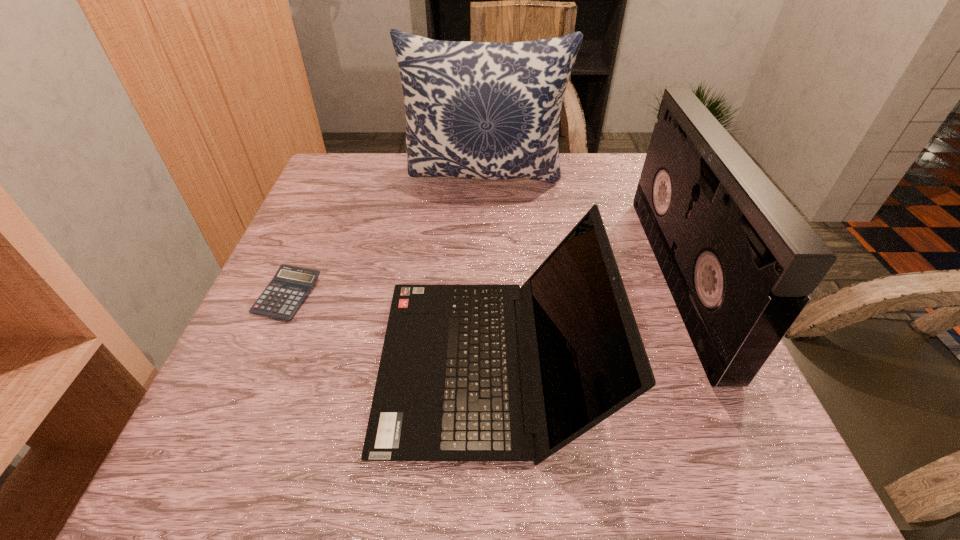
The width and height of the screenshot is (960, 540). Identify the location of free region located 0.280m on the front side of the second tallest object. (525, 278).

This screenshot has height=540, width=960. Find the location of `free space located on the screen of the third tallest object`. free space located on the screen of the third tallest object is located at coordinates (234, 363).

Where is `free space located on the screen of the third tallest object`? This screenshot has width=960, height=540. free space located on the screen of the third tallest object is located at coordinates (293, 363).

Image resolution: width=960 pixels, height=540 pixels. Find the location of `vacant space located 0.180m on the screen of the third tallest object`. vacant space located 0.180m on the screen of the third tallest object is located at coordinates (276, 363).

You are a GUI agent. You are given a task and a screenshot of the screen. Output one action in this format:
    pyautogui.click(x=<x>, y=<y>)
    Task: Click on the vacant space located 0.130m on the back of the shortest object
    This screenshot has height=540, width=960.
    Given the screenshot: What is the action you would take?
    coord(315,232)

The width and height of the screenshot is (960, 540). I want to click on object located in the far edge section of the desktop, so click(480, 110).

This screenshot has height=540, width=960. Identify the location of object that is at the near edge. (448, 389).

The height and width of the screenshot is (540, 960). I want to click on object positioned at the left edge, so click(290, 286).

The height and width of the screenshot is (540, 960). Find the location of `object that is at the right edge`. object that is at the right edge is located at coordinates (739, 260).

This screenshot has height=540, width=960. Identify the location of vacant space at the far edge of the desktop. (437, 195).